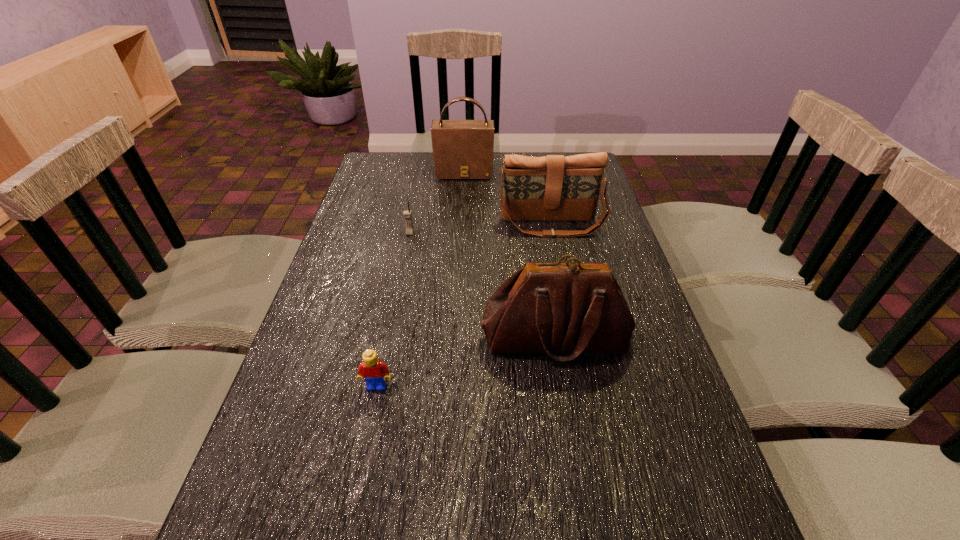
The image size is (960, 540). Identify the location of empty space that is in between the nearest object and the cellular telephone. (394, 309).

In order to click on unoccupied position between the Lego and the cellular telephone in this screenshot , I will do `click(394, 309)`.

Identify which object is the fourth closest to the cellular telephone. Please provide its 2D coordinates. Your answer should be formatted as a tuple, i.e. [(x, y)], where the tuple contains the x and y coordinates of a point satisfying the conditions above.

[(374, 371)]

Select which object appears as the second closest to the second nearest shoulder bag. Please provide its 2D coordinates. Your answer should be formatted as a tuple, i.e. [(x, y)], where the tuple contains the x and y coordinates of a point satisfying the conditions above.

[(407, 215)]

Locate which shoulder bag ranks in proximity to the farthest object. Please provide its 2D coordinates. Your answer should be formatted as a tuple, i.e. [(x, y)], where the tuple contains the x and y coordinates of a point satisfying the conditions above.

[(550, 188)]

Where is `the second closest shoulder bag to the second farthest shoulder bag`? This screenshot has width=960, height=540. the second closest shoulder bag to the second farthest shoulder bag is located at coordinates (574, 308).

The height and width of the screenshot is (540, 960). Find the location of `vacant space that satisfies the following two spatial constraints: 1. on the front of the nearest shoulder bag, where the keypad is located; 2. on the left side of the cellular telephone`. vacant space that satisfies the following two spatial constraints: 1. on the front of the nearest shoulder bag, where the keypad is located; 2. on the left side of the cellular telephone is located at coordinates (389, 338).

I want to click on vacant region that satisfies the following two spatial constraints: 1. on the front of the nearest shoulder bag, where the keypad is located; 2. on the left side of the cellular telephone, so click(x=389, y=338).

Image resolution: width=960 pixels, height=540 pixels. I want to click on free location that satisfies the following two spatial constraints: 1. on the front of the nearest shoulder bag, where the keypad is located; 2. on the left side of the cellular telephone, so [389, 338].

Locate an element on the screen. This screenshot has width=960, height=540. free spot that satisfies the following two spatial constraints: 1. on the front of the cellular telephone, where the keypad is located; 2. on the left side of the nearest shoulder bag is located at coordinates (389, 338).